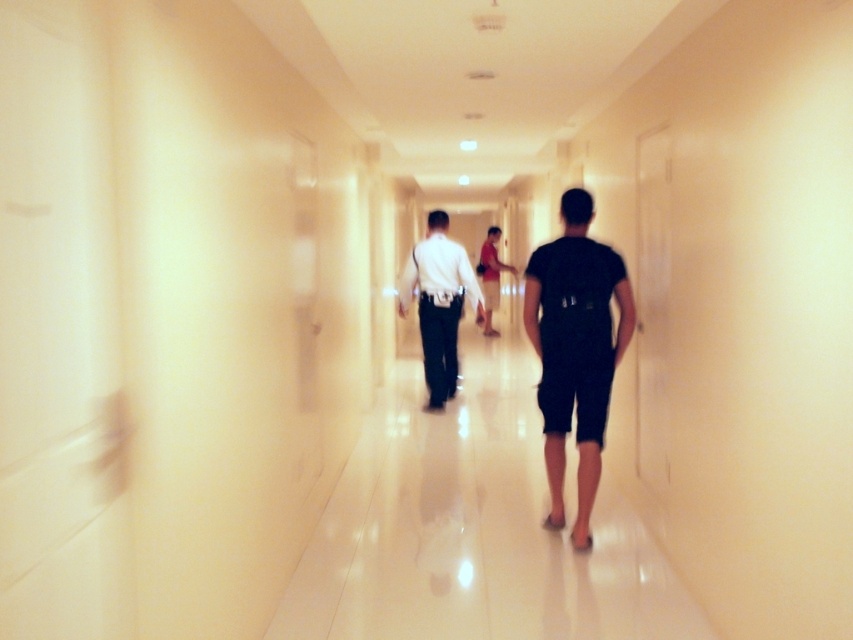
Question: Can you confirm if black matte shorts at center is wider than matte red shirt at center?

Choices:
 (A) no
 (B) yes

Answer: (A)

Question: Among these objects, which one is farthest from the camera?

Choices:
 (A) white glossy shirt at center
 (B) black matte shorts at center
 (C) matte red shirt at center

Answer: (C)

Question: Is black matte shorts at center bigger than matte red shirt at center?

Choices:
 (A) yes
 (B) no

Answer: (B)

Question: Is black matte shorts at center smaller than matte red shirt at center?

Choices:
 (A) yes
 (B) no

Answer: (A)

Question: Which of the following is the farthest from the observer?

Choices:
 (A) matte red shirt at center
 (B) white glossy shirt at center
 (C) black matte shorts at center

Answer: (A)

Question: Among these objects, which one is nearest to the camera?

Choices:
 (A) white glossy shirt at center
 (B) black matte shorts at center
 (C) matte red shirt at center

Answer: (B)